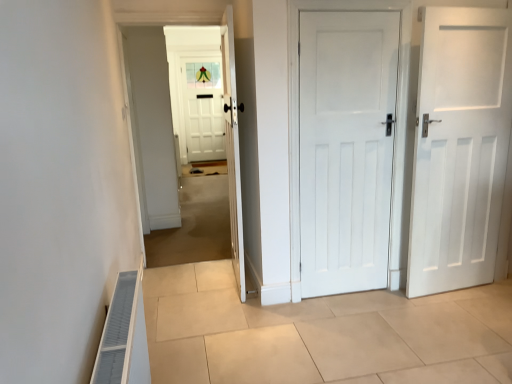
At what (x,y) coordinates should I click in order to perform the action: click on vacant region under white wooden door at center, placed as the first door when sorted from left to right (from a real-world perspective). Please return your answer as a coordinate pair (x, y). Looking at the image, I should click on (237, 280).